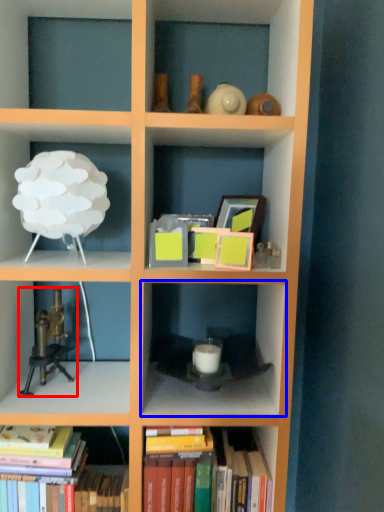
Question: Which of the following is the closest to the observer, toy (highlighted by a red box) or shelf (highlighted by a blue box)?

Choices:
 (A) toy
 (B) shelf

Answer: (B)